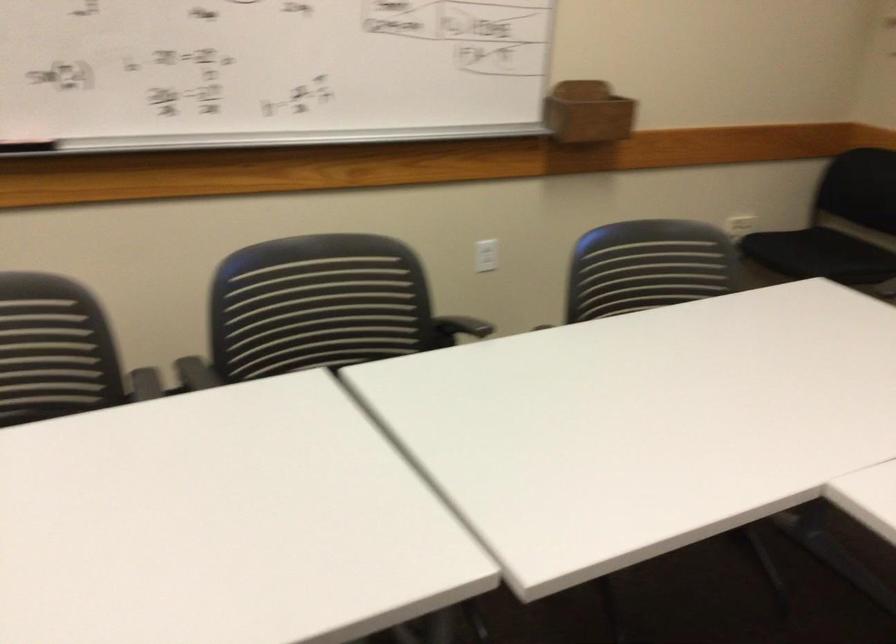
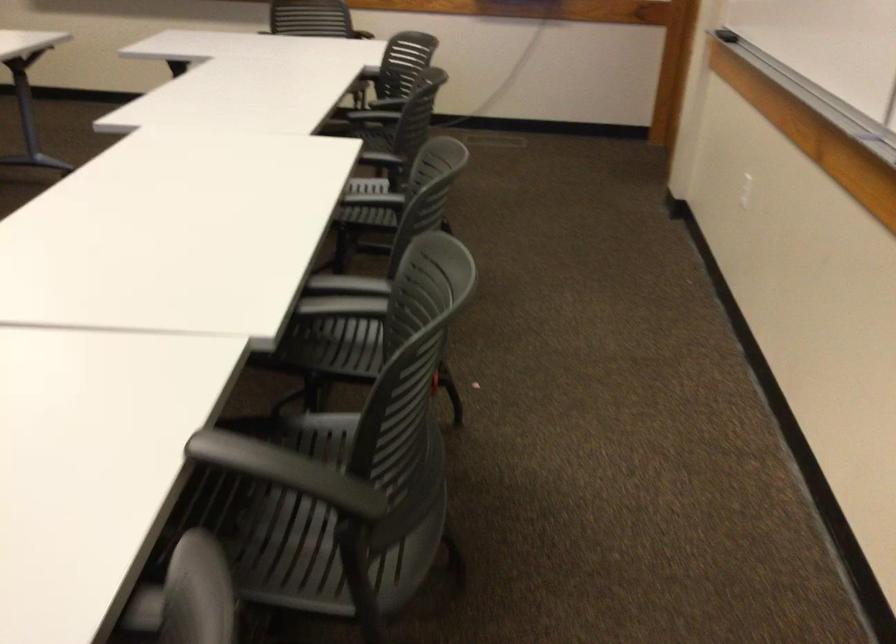
Question: I am providing you with two images of the same scene from different viewpoints. After the viewpoint changes to image2, which objects are now occluded?

Choices:
 (A) black chair armrest
 (B) orange scissors handles
 (C) chair sitting surface
 (D) black chair sitting surface

Answer: (C)